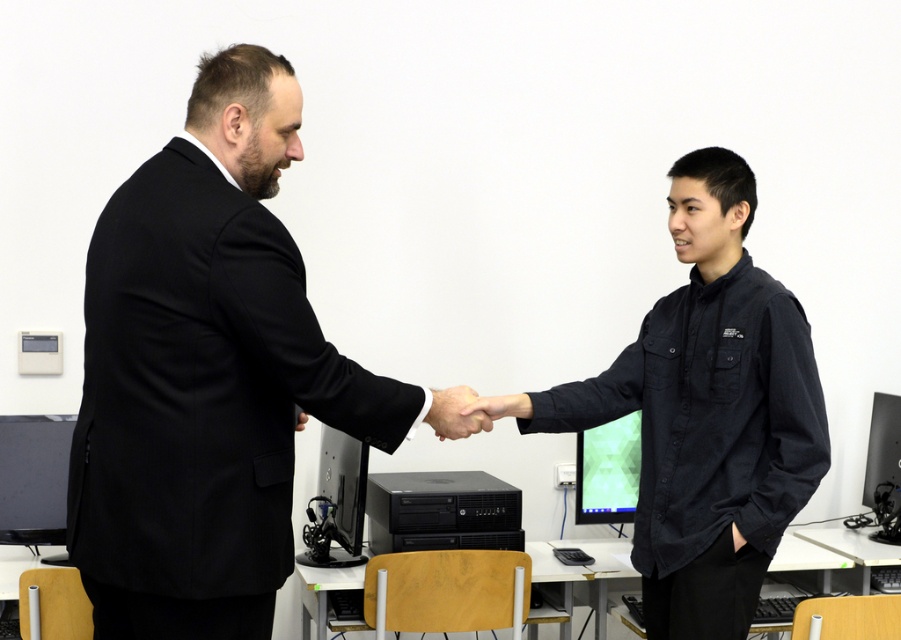
Question: Among these objects, which one is farthest from the camera?

Choices:
 (A) black matte shirt at right
 (B) black plastic computer tower at center

Answer: (B)

Question: Which object is farther from the camera taking this photo?

Choices:
 (A) green matte computer monitor at center
 (B) black glossy computer monitor at right
 (C) black matte shirt at right
 (D) black plastic computer tower at center

Answer: (B)

Question: Where is black matte shirt at right located in relation to black glossy computer monitor at right in the image?

Choices:
 (A) below
 (B) above

Answer: (B)

Question: Does black plastic computer tower at center have a greater width compared to black glossy computer monitor at right?

Choices:
 (A) no
 (B) yes

Answer: (B)

Question: Does black suit at left have a larger size compared to black matte shirt at right?

Choices:
 (A) yes
 (B) no

Answer: (B)

Question: Estimate the real-world distances between objects in this image. Which object is closer to the matte black monitor at center?

Choices:
 (A) green matte computer monitor at center
 (B) matte black hand at center

Answer: (A)